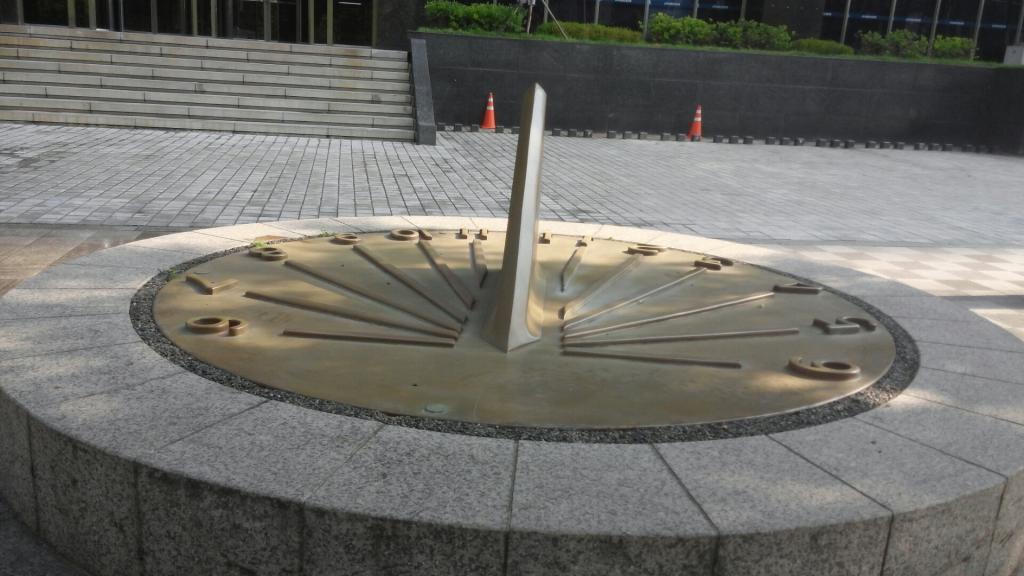
The image size is (1024, 576). Find the location of `stairs`. stairs is located at coordinates (253, 90).